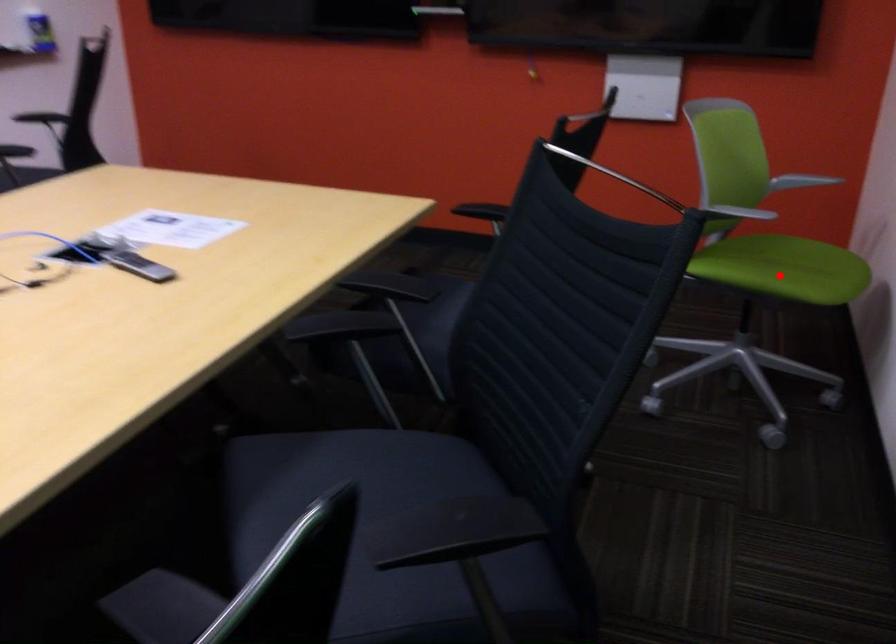
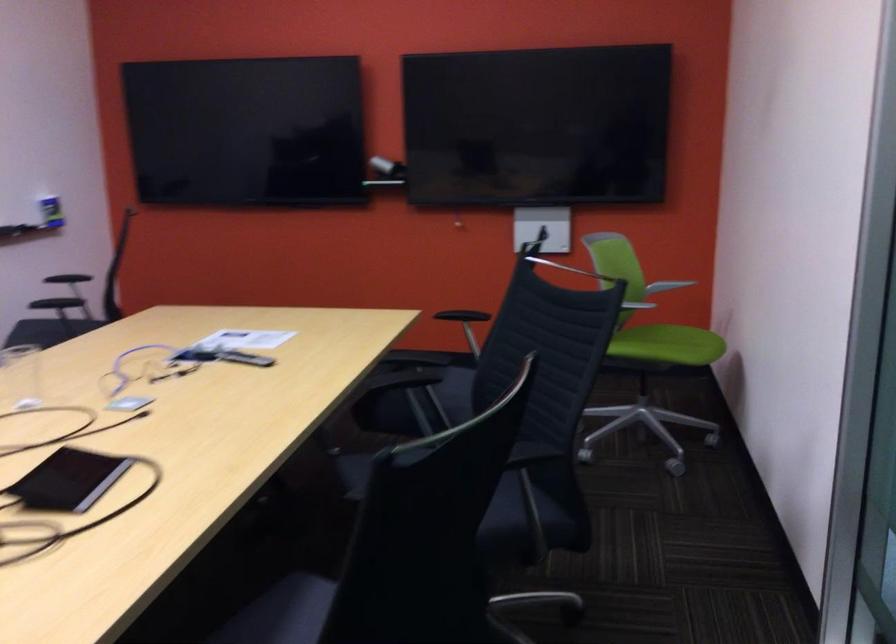
Question: I am providing you with two images of the same scene from different viewpoints. A red point is shown in image1. For the corresponding object point in image2, is it positioned nearer or farther from the camera?

Choices:
 (A) Nearer
 (B) Farther

Answer: (B)